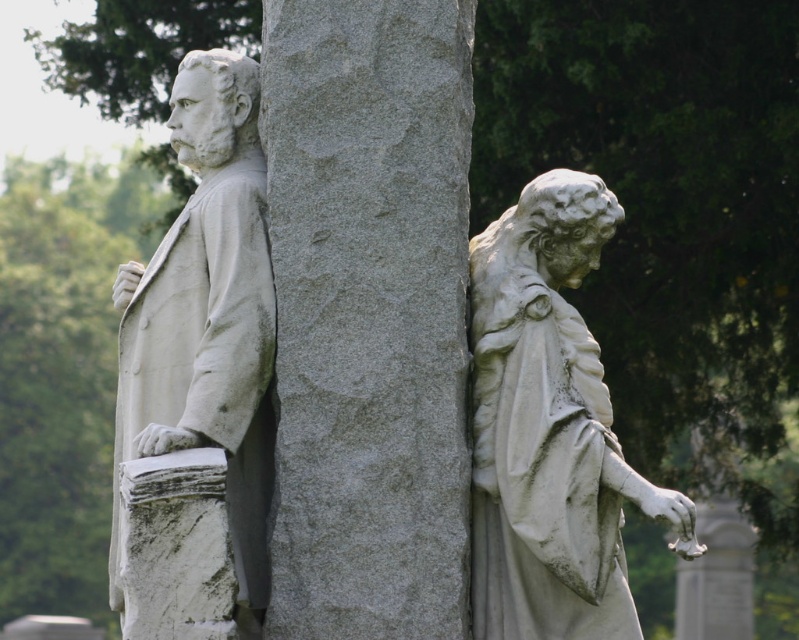
Between white marble statue at right and white marble statue at left, which one appears on the right side from the viewer's perspective?

white marble statue at right

Is point (595, 230) behind point (215, 353)?

Yes, point (595, 230) is farther from viewer.

Does point (571, 570) lie behind point (237, 112)?

No, (571, 570) is in front of (237, 112).

Find the location of `white marble statue at right`. white marble statue at right is located at coordinates (547, 428).

Is gray stone column at center thinner than white marble statue at right?

Yes, gray stone column at center is thinner than white marble statue at right.

Which is behind, point (348, 440) or point (583, 332)?

Positioned behind is point (583, 332).

Between point (307, 474) and point (587, 481), which one is positioned in front?

Point (587, 481)

The height and width of the screenshot is (640, 799). I want to click on gray stone column at center, so click(x=368, y=314).

Does gray stone column at center have a smaller size compared to white marble statue at left?

Correct, gray stone column at center occupies less space than white marble statue at left.

Does gray stone column at center lie behind white marble statue at left?

Result: Yes, gray stone column at center is further from the viewer.

Who is more forward, (315, 323) or (263, 560)?

Point (315, 323) is more forward.

Identify the location of gray stone column at center. (368, 314).